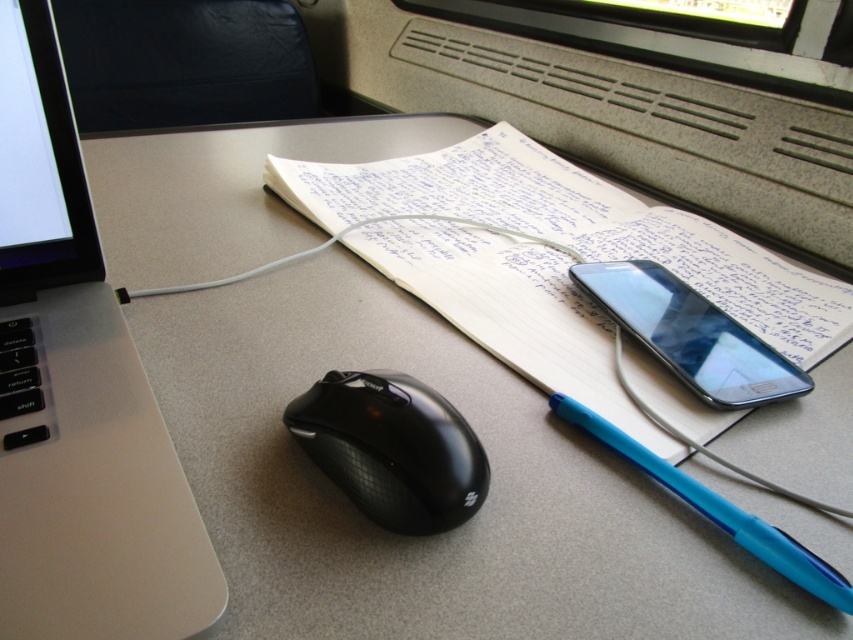
You are organizing your desk and need to place a 12 inch ruler between the white paper at center and the blue plastic pen at lower right. Will the ruler fit perfectly between them?

The distance between the white paper at center and the blue plastic pen at lower right is 12.04 inches, so the 12 inch ruler will fit with a small amount of space remaining.

You are organizing your desk and want to place a new wireless charger on the desk. The charger requires a clear space of 10x10 cm. Based on the scene, is there enough space between the sleek silver laptop at left and the open notebook in the center to place the charger?

The sleek silver laptop at left is located at point (77,396). However, without specific spatial measurements between the laptop and the open notebook, it is impossible to determine if there is sufficient space for the charger. Please measure the distance between the two objects first.